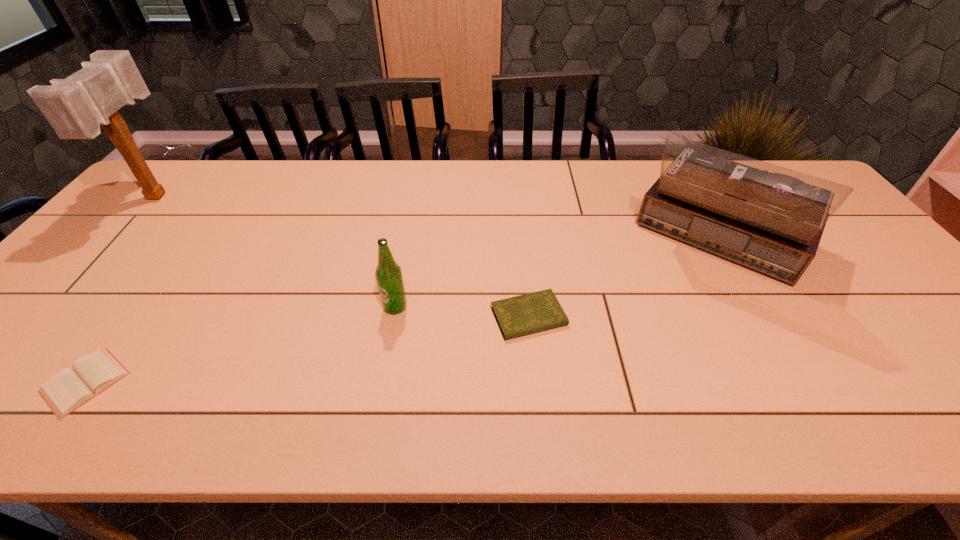
The height and width of the screenshot is (540, 960). Identify the location of vacant region located 0.200m on the front of the mallet. (90, 273).

Where is `free space located on the left of the rightmost object`? free space located on the left of the rightmost object is located at coordinates (572, 243).

Where is `free spot located 0.150m on the label of the third tallest object`? free spot located 0.150m on the label of the third tallest object is located at coordinates coord(384,370).

At what (x,y) coordinates should I click in order to perform the action: click on vacant space located on the left of the farther diary. Please return your answer as a coordinate pair (x, y). This screenshot has width=960, height=540. Looking at the image, I should click on (385, 317).

Locate an element on the screen. free space located 0.290m on the back of the fourth object from right to left is located at coordinates point(173,260).

Find the location of `mallet located in the far edge section of the desktop`. mallet located in the far edge section of the desktop is located at coordinates (75, 107).

The width and height of the screenshot is (960, 540). I want to click on record player located at the far edge, so click(x=769, y=218).

This screenshot has height=540, width=960. In order to click on object that is at the near edge in this screenshot , I will do `click(67, 390)`.

Find the location of `object located at the left edge`. object located at the left edge is located at coordinates (75, 107).

Where is `object at the right edge`? The width and height of the screenshot is (960, 540). object at the right edge is located at coordinates tap(769, 218).